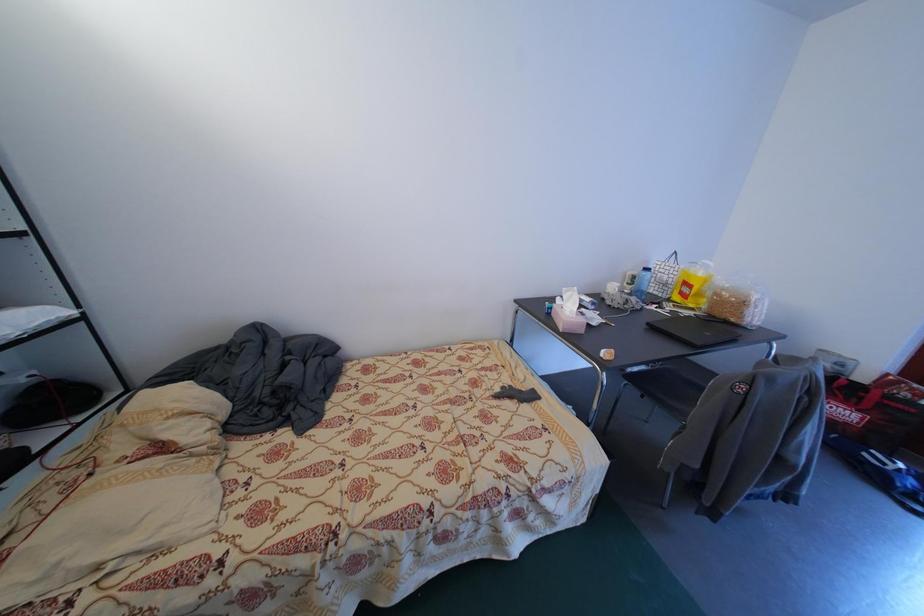
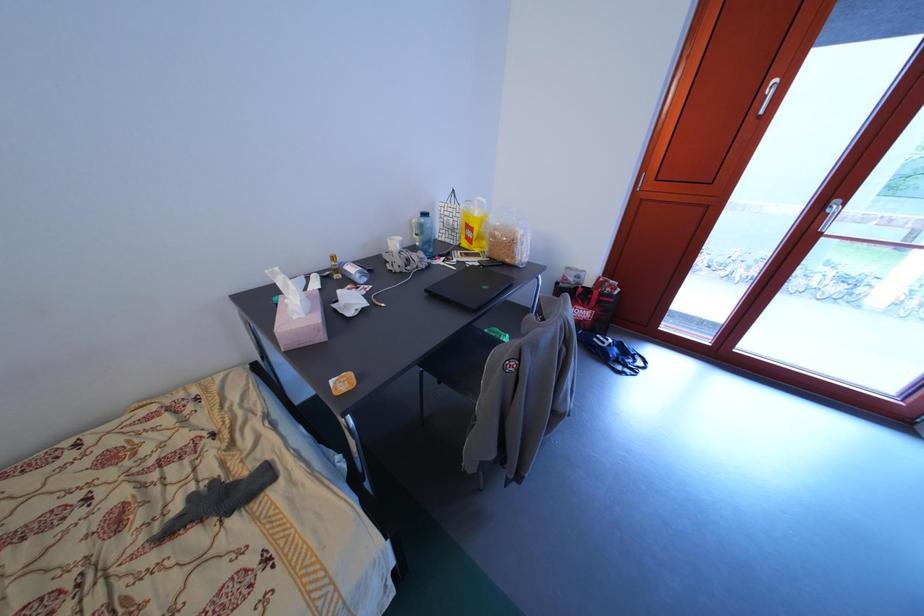
Question: The camera is either moving clockwise (left) or counter-clockwise (right) around the object. The first image is from the beginning of the video and the second image is from the end. Is the camera moving left or right when shooting the video?

Choices:
 (A) Left
 (B) Right

Answer: (A)